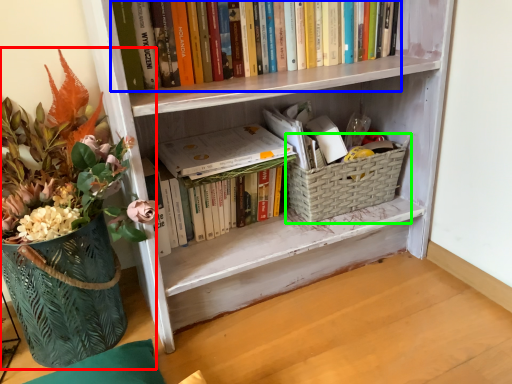
Question: Estimate the real-world distances between objects in this image. Which object is closer to houseplant (highlighted by a red box), book (highlighted by a blue box) or basket container (highlighted by a green box)?

Choices:
 (A) book
 (B) basket container

Answer: (A)